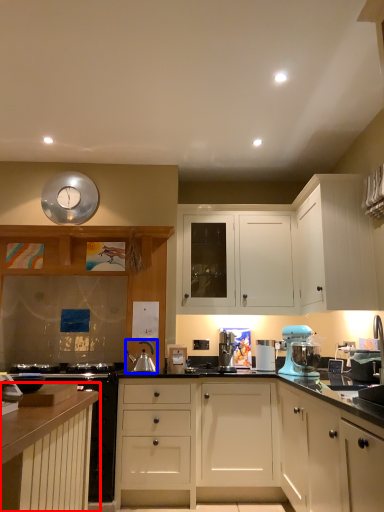
Question: Which of the following is the farthest to the observer, cabinetry (highlighted by a red box) or appliance (highlighted by a blue box)?

Choices:
 (A) cabinetry
 (B) appliance

Answer: (B)